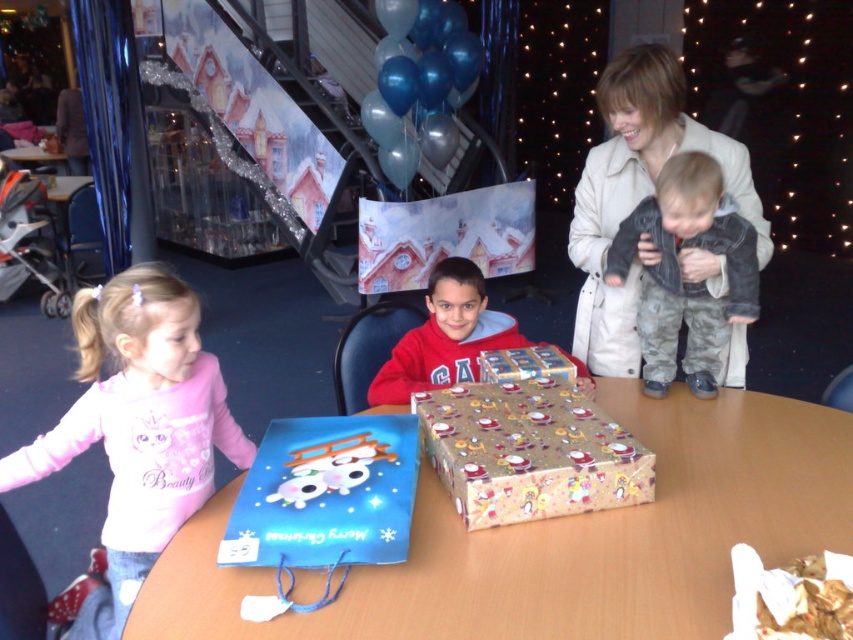
Consider the image. Who is higher up, wooden table at center or red matte sweater at center?

red matte sweater at center

Is point (703, 444) behind point (440, 385)?

No.

Who is more distant from viewer, (x=791, y=512) or (x=412, y=364)?

Positioned behind is point (x=412, y=364).

Image resolution: width=853 pixels, height=640 pixels. What are the coordinates of `wooden table at center` in the screenshot? It's located at (561, 541).

Who is more forward, (190, 364) or (463, 298)?

Positioned in front is point (190, 364).

Is point (146, 388) positioned in front of point (474, 342)?

Yes, it is.

Locate an element on the screen. pink fleece shirt at lower left is located at coordinates (138, 428).

Which is behind, point (155, 355) or point (549, 372)?

The point (549, 372) is behind.

Does point (80, 316) lie behind point (543, 353)?

That is False.

Locate an element on the screen. The width and height of the screenshot is (853, 640). pink fleece shirt at lower left is located at coordinates (138, 428).